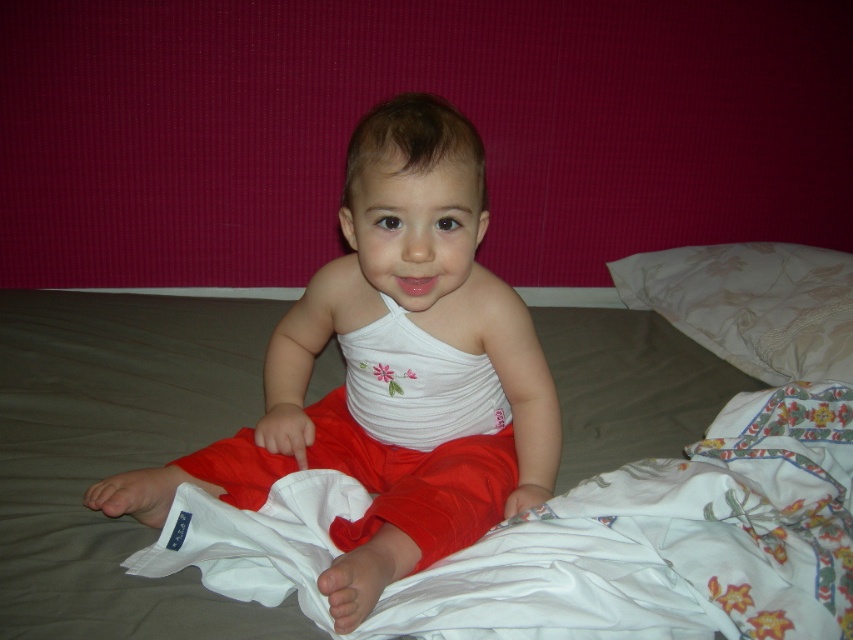
Between white fabric bed at center and white textured pillow at upper right, which one has more height?

white fabric bed at center is taller.

Does white fabric bed at center have a smaller size compared to white textured pillow at upper right?

Actually, white fabric bed at center might be larger than white textured pillow at upper right.

Where is `white fabric bed at center`? Image resolution: width=853 pixels, height=640 pixels. white fabric bed at center is located at coordinates (102, 436).

I want to click on white soft fabric at center, so click(393, 371).

You are a GUI agent. You are given a task and a screenshot of the screen. Output one action in this format:
    pyautogui.click(x=<x>, y=<y>)
    Task: Click on the white soft fabric at center
    Image resolution: width=853 pixels, height=640 pixels.
    Given the screenshot: What is the action you would take?
    [x=393, y=371]

Which is in front, point (350, 598) or point (734, 273)?

Point (350, 598) is more forward.

What are the coordinates of `white soft fabric at center` in the screenshot? It's located at (393, 371).